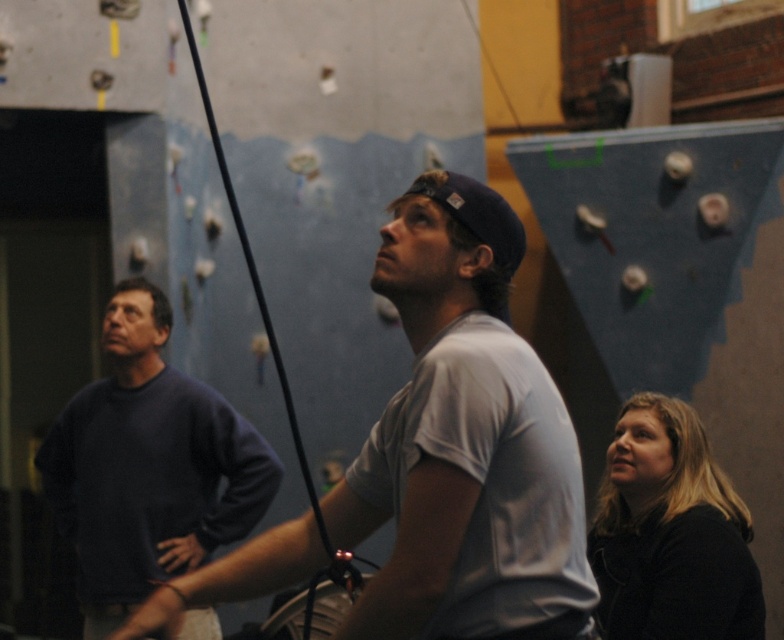
You are standing in the bouldering gym and see the dark blue sweater at left. If you want to locate it precisely on a coordinate system where the bottom left corner is the origin, what are its coordinates?

The dark blue sweater at left is located at coordinates approximately 0.728 on the x axis and 0.190 on the y axis.